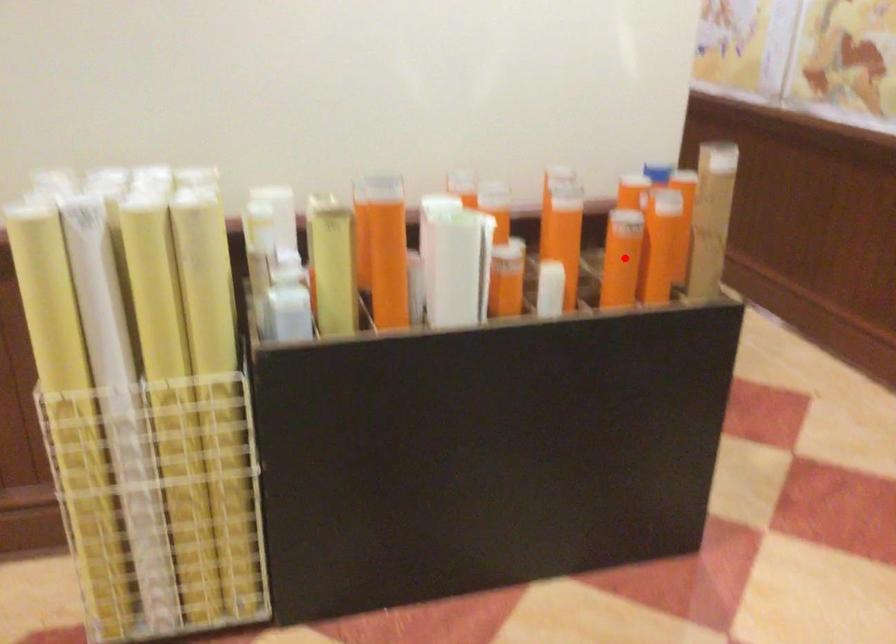
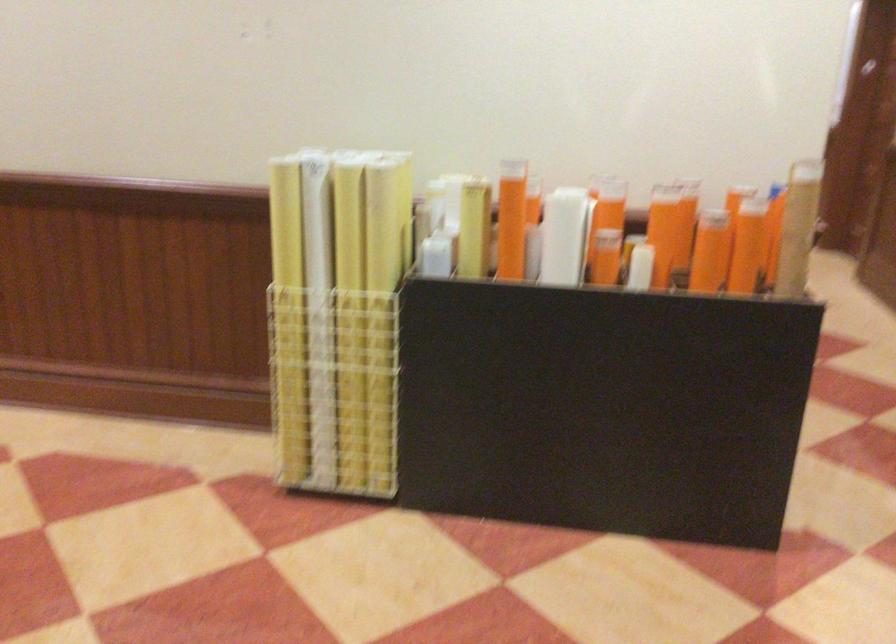
Find the pixel in the second image that matches the highlighted location in the first image.

(710, 251)